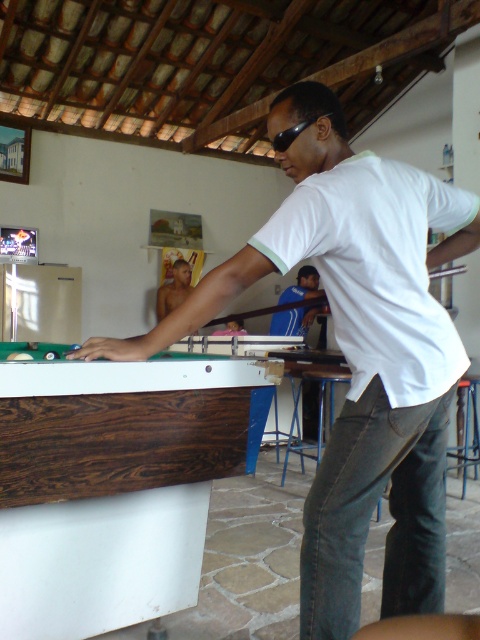
Can you confirm if blue fabric shirt at center is positioned to the left of shiny skin torso at center?

No, blue fabric shirt at center is not to the left of shiny skin torso at center.

Is point (269, 324) more distant than point (190, 280)?

That is True.

Image resolution: width=480 pixels, height=640 pixels. What are the coordinates of `blue fabric shirt at center` in the screenshot? It's located at (292, 321).

Is blue fabric shirt at center closer to camera compared to black plastic goggles at center?

No, blue fabric shirt at center is further to the viewer.

Find the location of a particular element. blue fabric shirt at center is located at coordinates 292,321.

Where is `blue fabric shirt at center`? This screenshot has height=640, width=480. blue fabric shirt at center is located at coordinates (292, 321).

Which of these two, dark wood billiard table at left or blue fabric shirt at center, stands taller?

Standing taller between the two is dark wood billiard table at left.

Does dark wood billiard table at left appear under blue fabric shirt at center?

Correct, dark wood billiard table at left is located below blue fabric shirt at center.

Does point (241, 433) lie behind point (279, 324)?

That is False.

You are a GUI agent. You are given a task and a screenshot of the screen. Output one action in this format:
    pyautogui.click(x=<x>, y=<y>)
    Task: Click on the dark wood billiard table at left
    
    Given the screenshot: What is the action you would take?
    pyautogui.click(x=121, y=422)